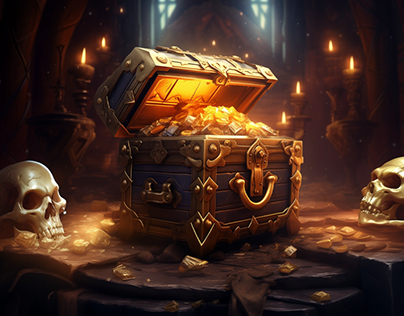
Where is `handle`? The image size is (404, 316). handle is located at coordinates (257, 202), (164, 194).